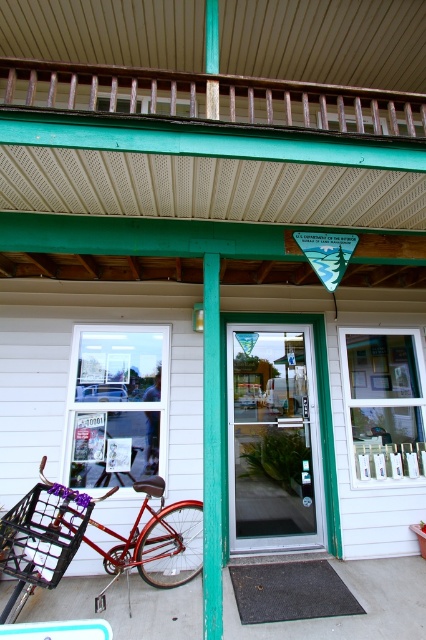
Is clear glass door at center behind shiny red bicycle at lower left?

Yes, it is behind shiny red bicycle at lower left.

Is clear glass door at center smaller than shiny red bicycle at lower left?

Incorrect, clear glass door at center is not smaller in size than shiny red bicycle at lower left.

The image size is (426, 640). What do you see at coordinates (273, 438) in the screenshot?
I see `clear glass door at center` at bounding box center [273, 438].

The width and height of the screenshot is (426, 640). In order to click on clear glass door at center in this screenshot , I will do `click(273, 438)`.

Who is more distant from viewer, (250, 396) or (176, 99)?

The point (250, 396) is more distant.

Who is positioned more to the left, clear glass door at center or rusty wood rail at upper center?

rusty wood rail at upper center

What do you see at coordinates (273, 438) in the screenshot? I see `clear glass door at center` at bounding box center [273, 438].

Find the location of `clear glass door at center`. clear glass door at center is located at coordinates (273, 438).

Who is lower down, rusty wood rail at upper center or shiny red bicycle at lower left?

shiny red bicycle at lower left is lower down.

Find the location of `rusty wood rail at upper center`. rusty wood rail at upper center is located at coordinates (210, 99).